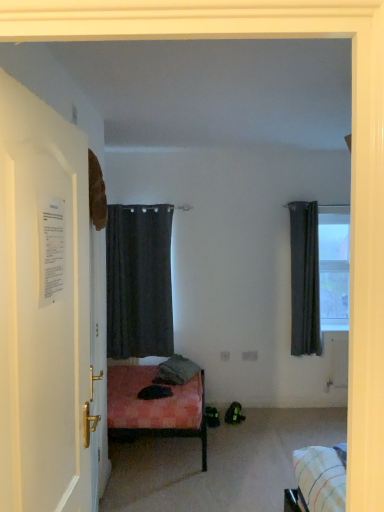
Question: Can you confirm if dark matte curtain at center, which is the first curtain in left-to-right order, is wider than dark gray fabric curtain at right, the 2th curtain when ordered from left to right?

Choices:
 (A) yes
 (B) no

Answer: (A)

Question: Does dark matte curtain at center, which is the first curtain in left-to-right order, touch dark gray fabric curtain at right, the 2th curtain when ordered from left to right?

Choices:
 (A) yes
 (B) no

Answer: (B)

Question: Would you say dark matte curtain at center, arranged as the 2th curtain when viewed from the right, contains dark gray fabric curtain at right, which is the first curtain from right to left?

Choices:
 (A) no
 (B) yes

Answer: (A)

Question: From a real-world perspective, is dark matte curtain at center, which is the first curtain in left-to-right order, under dark gray fabric curtain at right, the 2th curtain when ordered from left to right?

Choices:
 (A) no
 (B) yes

Answer: (B)

Question: Is dark matte curtain at center, arranged as the 2th curtain when viewed from the right, far from dark gray fabric curtain at right, the 2th curtain when ordered from left to right?

Choices:
 (A) no
 (B) yes

Answer: (B)

Question: Is point (119, 208) closer or farther from the camera than point (324, 207)?

Choices:
 (A) closer
 (B) farther

Answer: (A)

Question: Looking at their shapes, would you say dark matte curtain at center, which is the first curtain in left-to-right order, is wider or thinner than transparent glass window at upper right?

Choices:
 (A) thin
 (B) wide

Answer: (B)

Question: Is dark matte curtain at center, arranged as the 2th curtain when viewed from the right, inside the boundaries of transparent glass window at upper right, or outside?

Choices:
 (A) inside
 (B) outside

Answer: (B)

Question: From a real-world perspective, is dark matte curtain at center, which is the first curtain in left-to-right order, above or below transparent glass window at upper right?

Choices:
 (A) above
 (B) below

Answer: (B)

Question: Is gray fabric pillow at center inside the boundaries of transparent glass window at upper right, or outside?

Choices:
 (A) outside
 (B) inside

Answer: (A)

Question: From a real-world perspective, is gray fabric pillow at center positioned above or below transparent glass window at upper right?

Choices:
 (A) above
 (B) below

Answer: (B)

Question: Is gray fabric pillow at center to the left or to the right of transparent glass window at upper right in the image?

Choices:
 (A) right
 (B) left

Answer: (B)

Question: From the image's perspective, relative to transparent glass window at upper right, is gray fabric pillow at center above or below?

Choices:
 (A) above
 (B) below

Answer: (B)

Question: From the image's perspective, is transparent glass window at upper right located above or below white paper at left?

Choices:
 (A) above
 (B) below

Answer: (A)

Question: In the image, is transparent glass window at upper right on the left side or the right side of white paper at left?

Choices:
 (A) right
 (B) left

Answer: (A)